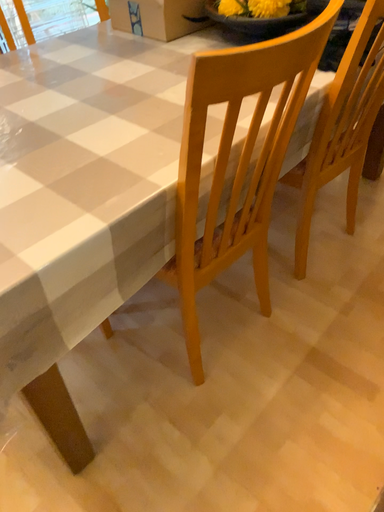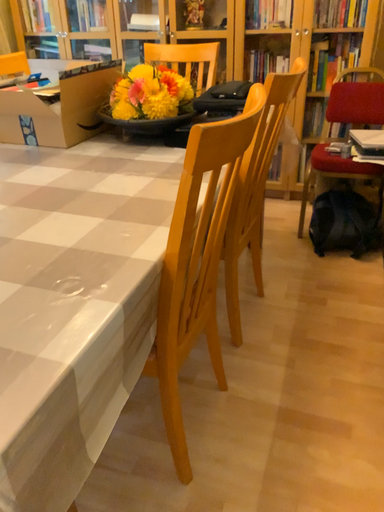
Question: How did the camera likely rotate when shooting the video?

Choices:
 (A) rotated downward
 (B) rotated upward

Answer: (B)